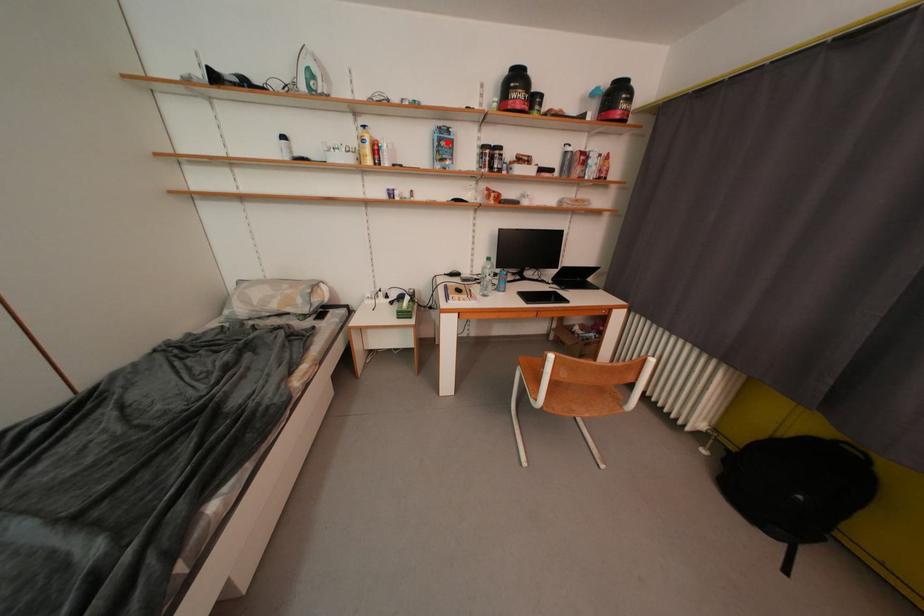
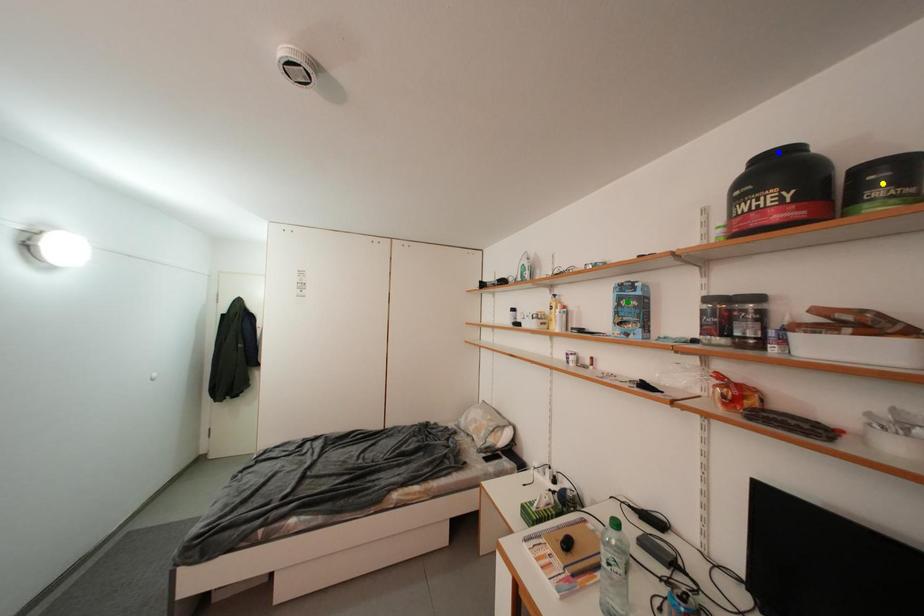
Question: I am providing you with two images of the same scene from different viewpoints. A red point is marked on the first image. You are given multiple points on the second image. Which point in image 2 represents the same 3d spot as the red point in image 1?

Choices:
 (A) yellow point
 (B) green point
 (C) blue point

Answer: (B)